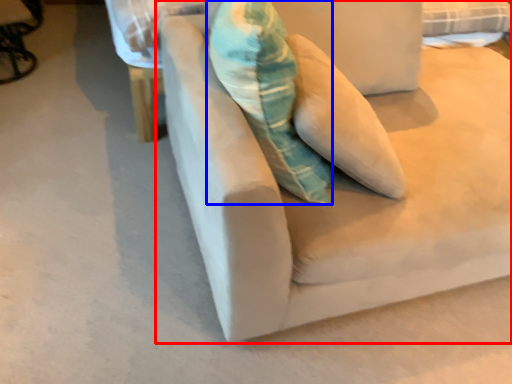
Question: Which of the following is the farthest to the observer, studio couch (highlighted by a red box) or throw pillow (highlighted by a blue box)?

Choices:
 (A) studio couch
 (B) throw pillow

Answer: (B)